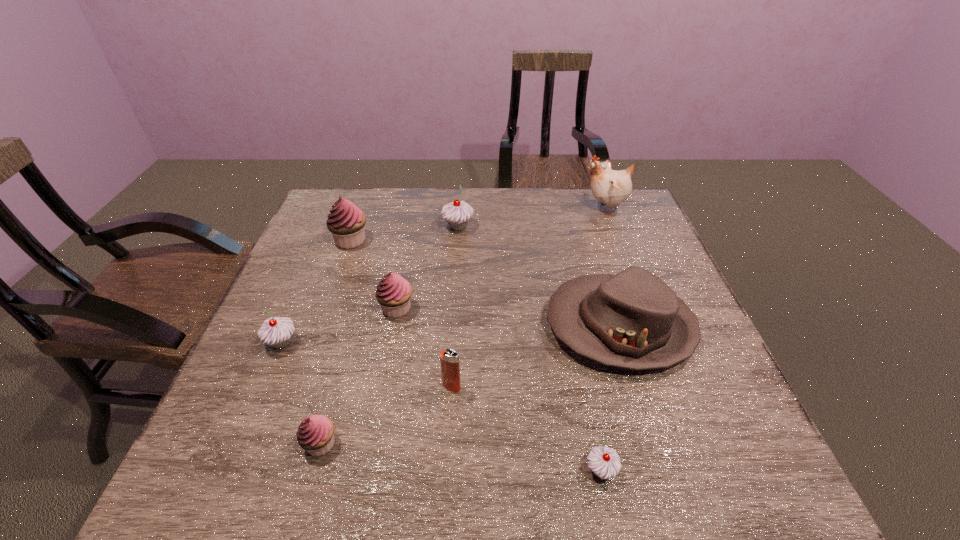
Locate an element on the screen. The image size is (960, 540). the third nearest object is located at coordinates (450, 368).

At what (x,y) coordinates should I click in order to perform the action: click on the smallest pink cupcake. Please return your answer as a coordinate pair (x, y). Looking at the image, I should click on (315, 434).

Locate an element on the screen. The image size is (960, 540). the rightmost gray cupcake is located at coordinates pyautogui.click(x=605, y=463).

You are a GUI agent. You are given a task and a screenshot of the screen. Output one action in this format:
    pyautogui.click(x=<x>, y=<y>)
    Task: Click on the nearest gray cupcake
    Image resolution: width=960 pixels, height=540 pixels.
    Given the screenshot: What is the action you would take?
    pyautogui.click(x=605, y=463)

Where is `vacant area situated at the beak of the white bird`? vacant area situated at the beak of the white bird is located at coordinates (463, 208).

This screenshot has height=540, width=960. I want to click on free space located 0.280m at the beak of the white bird, so click(x=493, y=208).

The height and width of the screenshot is (540, 960). I want to click on blank area located 0.210m at the beak of the white bird, so click(516, 208).

Image resolution: width=960 pixels, height=540 pixels. Find the location of `free space located 0.290m on the right of the farthest gray cupcake`. free space located 0.290m on the right of the farthest gray cupcake is located at coordinates (569, 227).

You are a GUI agent. You are given a task and a screenshot of the screen. Output one action in this format:
    pyautogui.click(x=<x>, y=<y>)
    Task: Click on the free space located on the right of the farthest pink cupcake
    This screenshot has height=540, width=960.
    Given the screenshot: What is the action you would take?
    pos(458,240)

Find the location of a particular element. vacant area situated on the decorative side of the hat is located at coordinates (486, 327).